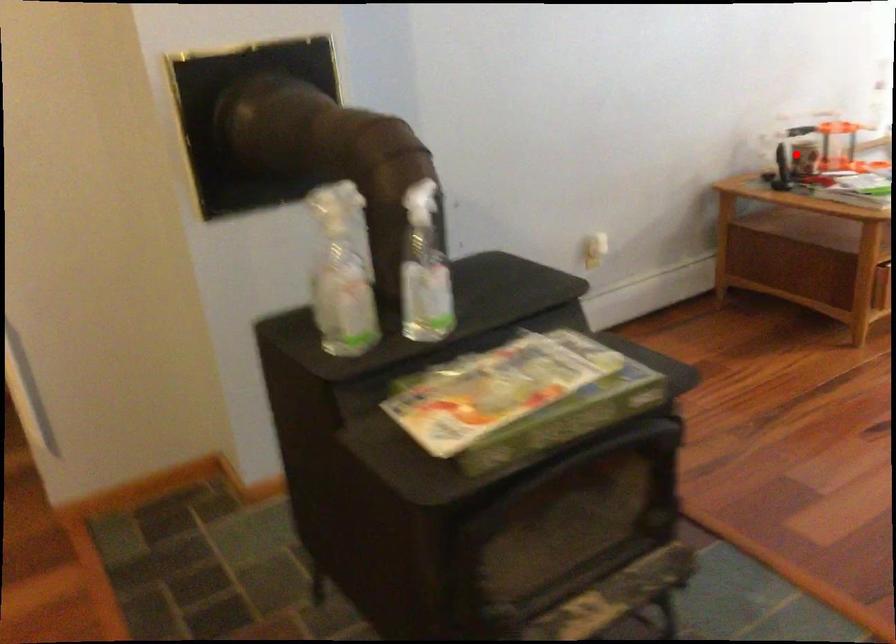
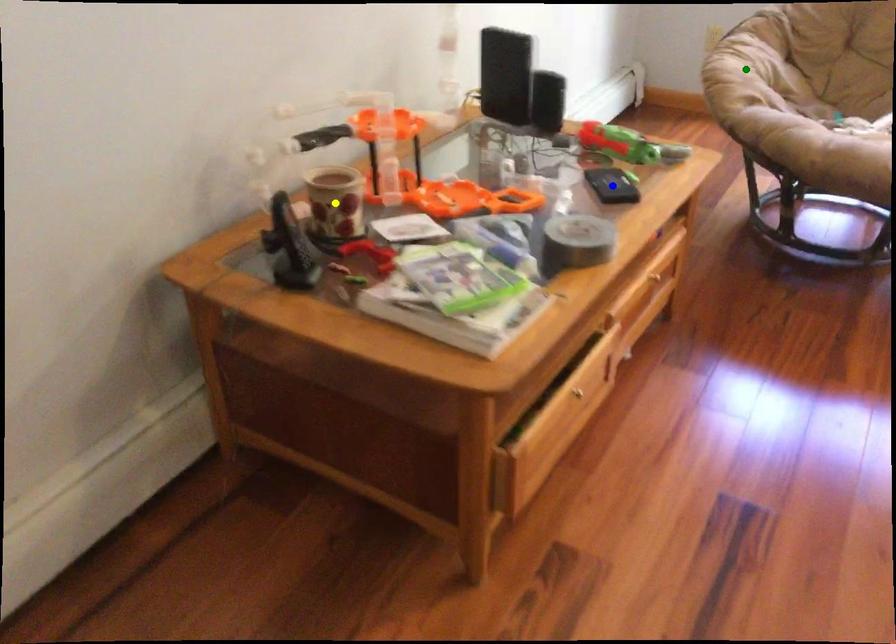
Question: I am providing you with two images of the same scene from different viewpoints. A red point is marked on the first image. You are given multiple points on the second image. Which point in image 2 represents the same 3d spot as the red point in image 1?

Choices:
 (A) yellow point
 (B) green point
 (C) blue point

Answer: (A)